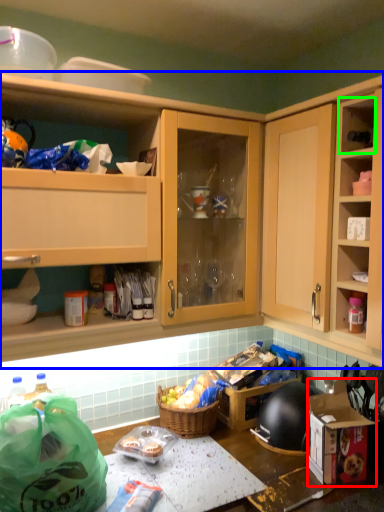
Question: Which is nearer to the cardboard box (highlighted by a red box)? cabinetry (highlighted by a blue box) or cabinet (highlighted by a green box).

Choices:
 (A) cabinetry
 (B) cabinet

Answer: (B)